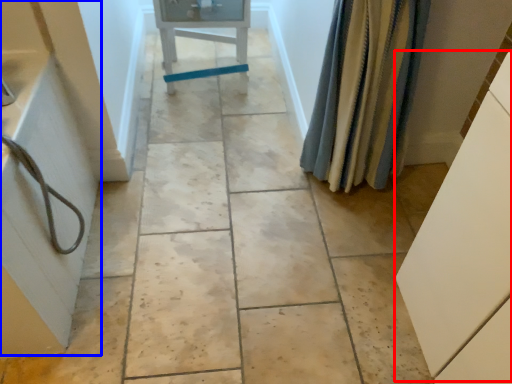
Question: Which object is further to the camera taking this photo, cabinetry (highlighted by a red box) or bath (highlighted by a blue box)?

Choices:
 (A) cabinetry
 (B) bath

Answer: (B)